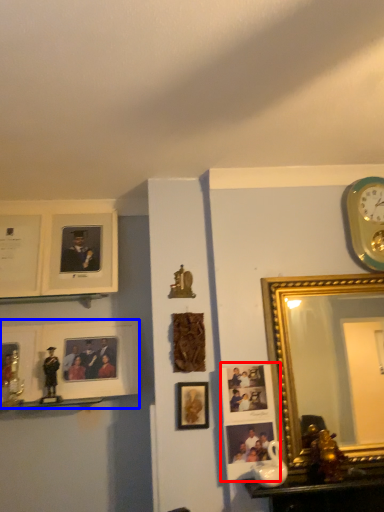
Question: Among these objects, which one is nearest to the camera, picture frame (highlighted by a red box) or picture frame (highlighted by a blue box)?

Choices:
 (A) picture frame
 (B) picture frame

Answer: (A)